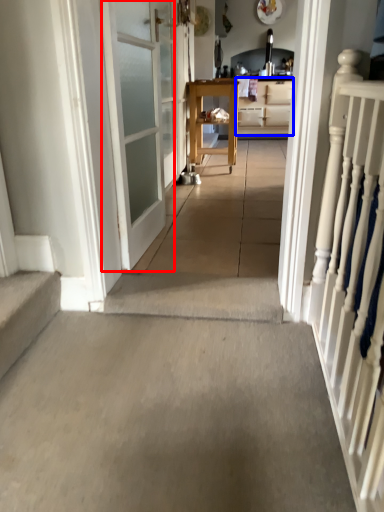
Question: Which point is closer to the camera, door (highlighted by a red box) or cabinetry (highlighted by a blue box)?

Choices:
 (A) door
 (B) cabinetry

Answer: (A)